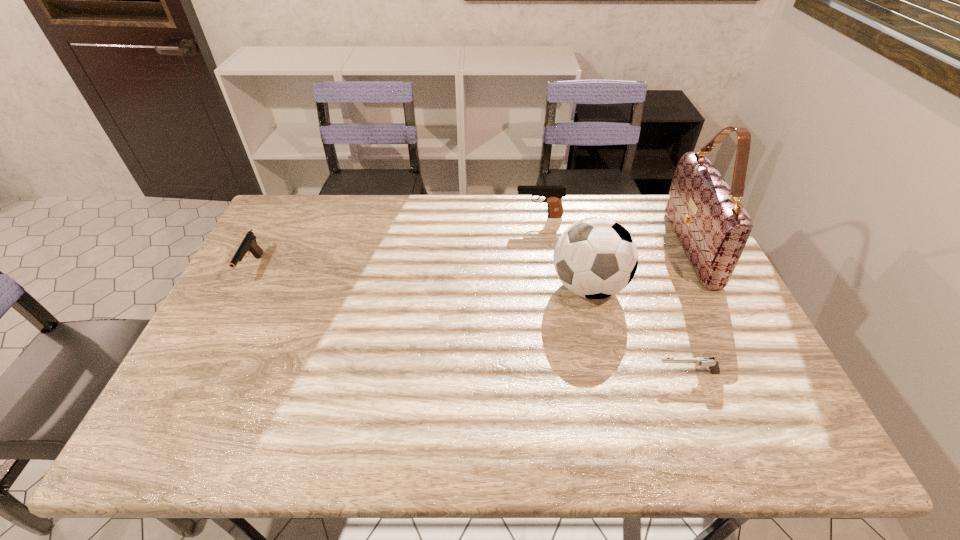
You are a GUI agent. You are given a task and a screenshot of the screen. Output one action in this format:
    pyautogui.click(x=<x>, y=<y>)
    Task: Click on the vacant space located 0.250m on the front-facing side of the nearest pistol
    The height and width of the screenshot is (540, 960).
    Given the screenshot: What is the action you would take?
    pyautogui.click(x=555, y=373)

Locate an element on the screen. This screenshot has height=540, width=960. vacant space positioned on the front-facing side of the nearest pistol is located at coordinates (559, 373).

Identify the location of handbag present at the far edge. (713, 227).

At what (x,y) coordinates should I click in order to perform the action: click on pistol that is at the far edge. Please return your answer as a coordinate pair (x, y). This screenshot has width=960, height=540. Looking at the image, I should click on (553, 194).

Find the location of a particular element. Image resolution: width=960 pixels, height=540 pixels. object located in the left edge section of the desktop is located at coordinates (249, 244).

Image resolution: width=960 pixels, height=540 pixels. In order to click on handbag that is positioned at the right edge in this screenshot , I will do `click(713, 227)`.

I want to click on pistol that is at the right edge, so click(713, 365).

The image size is (960, 540). What are the coordinates of `object located at the far right corner` in the screenshot? It's located at (713, 227).

In the image, there is a desktop. Where is `vacant space at the far edge`? The width and height of the screenshot is (960, 540). vacant space at the far edge is located at coordinates (433, 200).

The height and width of the screenshot is (540, 960). Identify the location of vacant region at the near edge of the desktop. (529, 423).